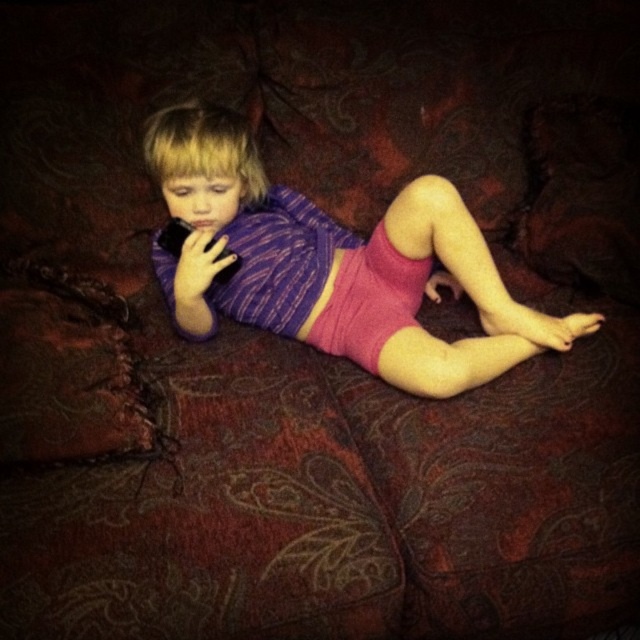
You are a fashion designer trying to create a new line of childrenswear. You see the pink knitted shorts at center and the pink fabric shorts at center in the image. How far apart are these two shorts from each other?

The pink knitted shorts at center and pink fabric shorts at center are 9.46 centimeters apart from each other.

Based on the scene description, what object is located at the coordinates point (333, 262)?

The pink knitted shorts at center are located at point (333, 262).